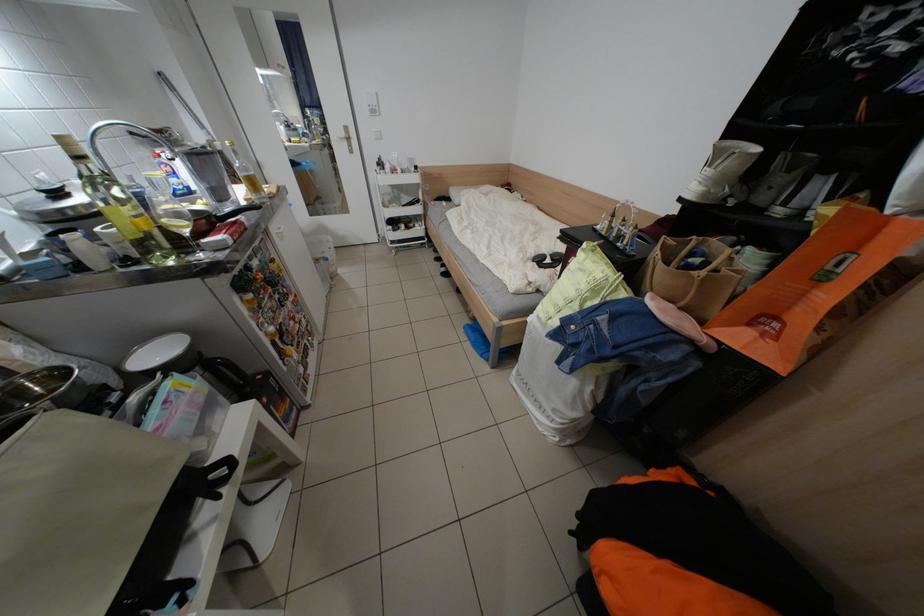
The height and width of the screenshot is (616, 924). What do you see at coordinates (116, 160) in the screenshot?
I see `a faucet handle` at bounding box center [116, 160].